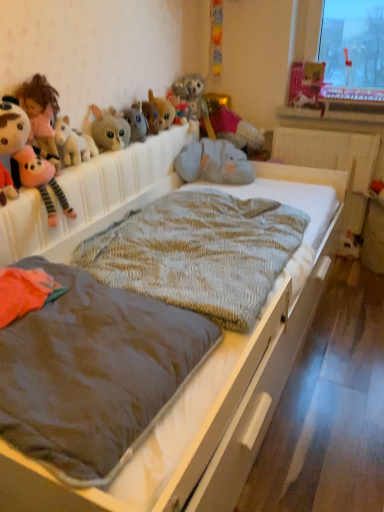
Question: Considering the relative positions of matte pink castle at upper right, placed as the 1th toy when sorted from right to left, and knitted woolen blanket at center, which appears as the 1th blanket when viewed from the back, in the image provided, is matte pink castle at upper right, placed as the 1th toy when sorted from right to left, in front of knitted woolen blanket at center, which appears as the 1th blanket when viewed from the back,?

Choices:
 (A) yes
 (B) no

Answer: (B)

Question: Is matte pink castle at upper right, placed as the 1th toy when sorted from right to left, aimed at knitted woolen blanket at center, which is counted as the 2th blanket, starting from the front?

Choices:
 (A) yes
 (B) no

Answer: (A)

Question: Considering the relative sizes of matte pink castle at upper right, placed as the 1th toy when sorted from right to left, and knitted woolen blanket at center, which appears as the 1th blanket when viewed from the back, in the image provided, is matte pink castle at upper right, placed as the 1th toy when sorted from right to left, taller than knitted woolen blanket at center, which appears as the 1th blanket when viewed from the back,?

Choices:
 (A) no
 (B) yes

Answer: (B)

Question: From the image's perspective, is matte pink castle at upper right, placed as the 1th toy when sorted from right to left, on top of knitted woolen blanket at center, which is counted as the 2th blanket, starting from the front?

Choices:
 (A) yes
 (B) no

Answer: (A)

Question: Is matte pink castle at upper right, which is the eighth toy from left to right, bigger than knitted woolen blanket at center, which is counted as the 2th blanket, starting from the front?

Choices:
 (A) no
 (B) yes

Answer: (A)

Question: From a real-world perspective, is soft plush toy at left, which is the 1th toy in left-to-right order, physically located above or below white plastic window sill at upper center?

Choices:
 (A) above
 (B) below

Answer: (A)

Question: From their relative heights in the image, would you say soft plush toy at left, which is the 1th toy in left-to-right order, is taller or shorter than white plastic window sill at upper center?

Choices:
 (A) short
 (B) tall

Answer: (B)

Question: Is soft plush toy at left, which is the 1th toy in left-to-right order, in front of or behind white plastic window sill at upper center in the image?

Choices:
 (A) front
 (B) behind

Answer: (A)

Question: Considering the positions of soft plush toy at left, which is the 1th toy in left-to-right order, and white plastic window sill at upper center in the image, is soft plush toy at left, which is the 1th toy in left-to-right order, wider or thinner than white plastic window sill at upper center?

Choices:
 (A) thin
 (B) wide

Answer: (A)

Question: Do you think fluffy plush toy at upper center, the fifth toy viewed from the right, is within fuzzy fabric bunny at upper center, which is counted as the fifth toy, starting from the left, or outside of it?

Choices:
 (A) outside
 (B) inside

Answer: (A)

Question: Looking at their shapes, would you say fluffy plush toy at upper center, the fifth toy viewed from the right, is wider or thinner than fuzzy fabric bunny at upper center, which ranks as the 4th toy in right-to-left order?

Choices:
 (A) thin
 (B) wide

Answer: (A)

Question: From the image's perspective, is fluffy plush toy at upper center, placed as the fourth toy when sorted from left to right, located above or below fuzzy fabric bunny at upper center, which ranks as the 4th toy in right-to-left order?

Choices:
 (A) below
 (B) above

Answer: (A)

Question: In the image, is fluffy plush toy at upper center, the fifth toy viewed from the right, positioned in front of or behind fuzzy fabric bunny at upper center, which is counted as the fifth toy, starting from the left?

Choices:
 (A) behind
 (B) front

Answer: (B)

Question: Choose the correct answer: Is matte pink castle at upper right, placed as the 1th toy when sorted from right to left, inside soft plush toy at left, the eighth toy from the right, or outside it?

Choices:
 (A) inside
 (B) outside

Answer: (B)

Question: Is point (314, 91) positioned closer to the camera than point (13, 122)?

Choices:
 (A) farther
 (B) closer

Answer: (A)